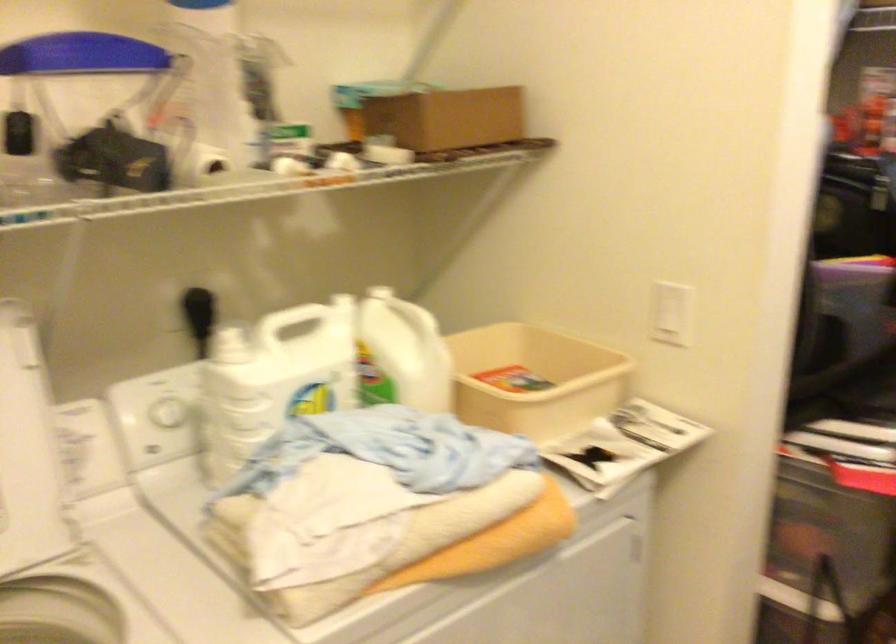
This screenshot has width=896, height=644. What are the coordinates of `beige plastic bin` in the screenshot? It's located at (533, 380).